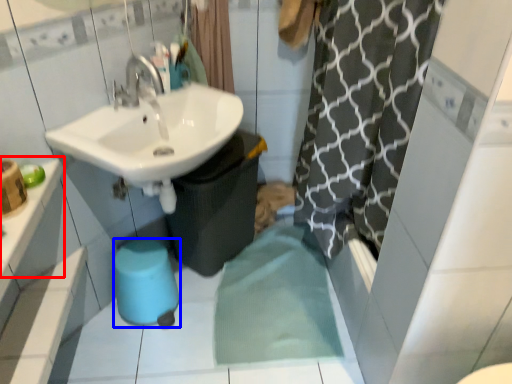
Question: Among these objects, which one is nearest to the camera, counter top (highlighted by a red box) or bidet (highlighted by a blue box)?

Choices:
 (A) counter top
 (B) bidet

Answer: (A)